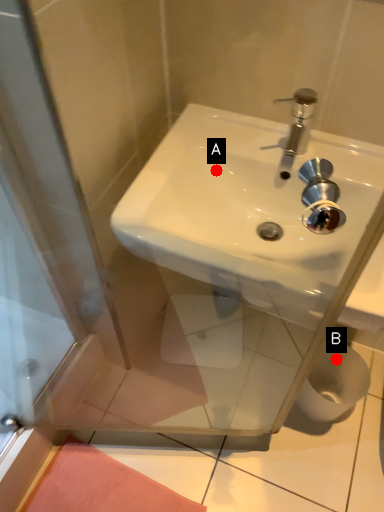
Question: Two points are circled on the image, labeled by A and B beside each circle. Which of the following is the closest to the observer?

Choices:
 (A) A is closer
 (B) B is closer

Answer: (A)